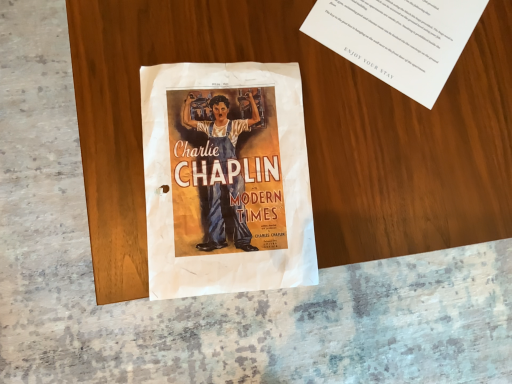
Locate an element on the screen. The height and width of the screenshot is (384, 512). vacant area on top of white paper at upper right (from a real-world perspective) is located at coordinates click(412, 28).